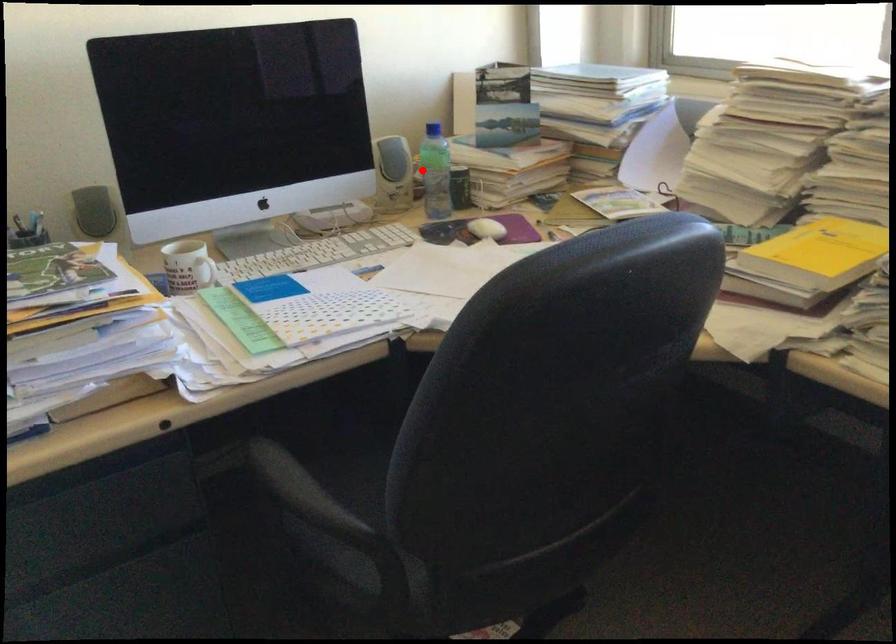
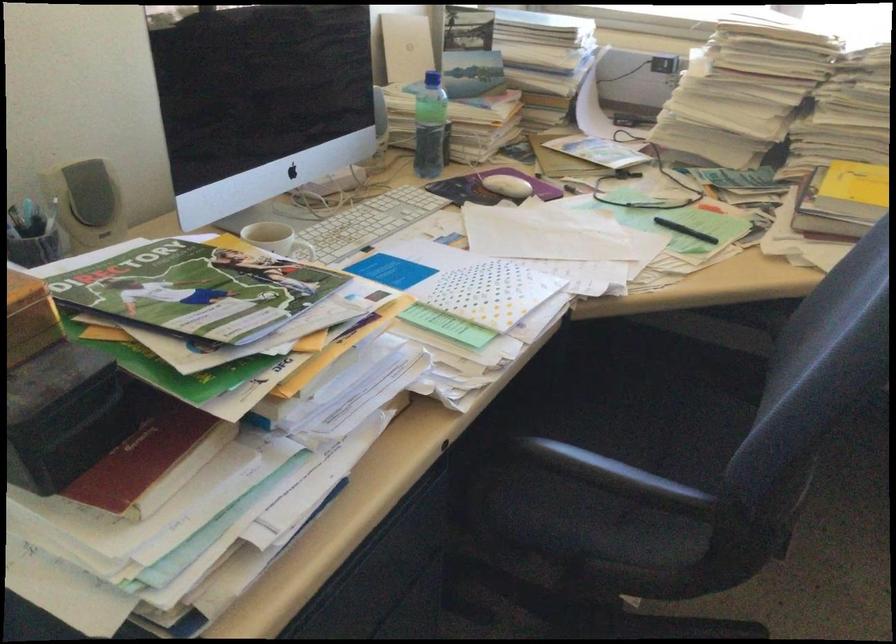
Question: I am providing you with two images of the same scene from different viewpoints. A red point is marked on the first image. Can you still see the location of the red point in image 2?

Choices:
 (A) Yes
 (B) No

Answer: (A)